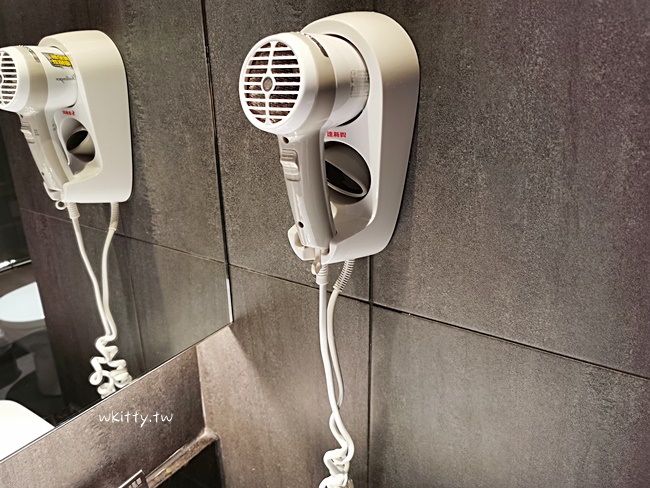
The width and height of the screenshot is (650, 488). Find the location of `backsplash`. backsplash is located at coordinates (86, 448).